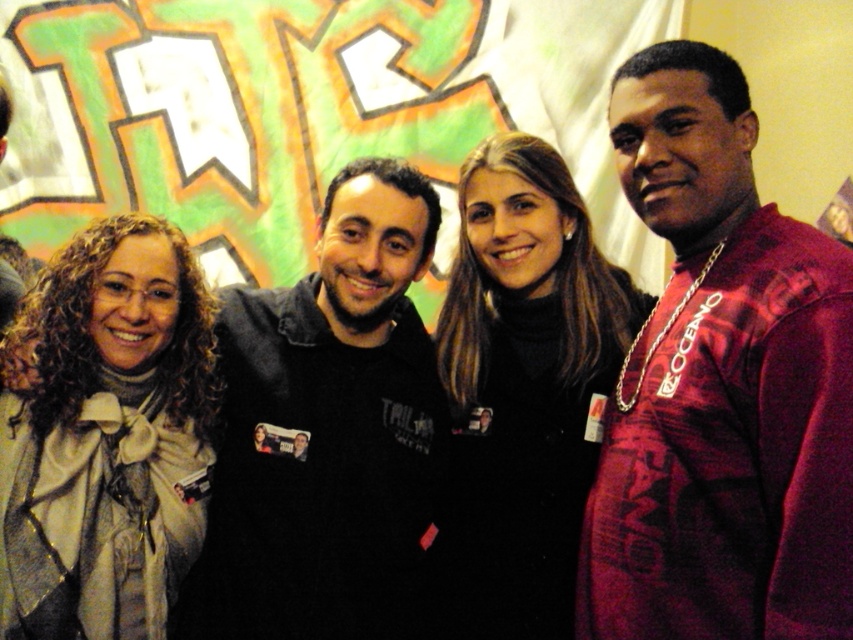
Can you confirm if shiny maroon shirt at right is positioned below black fleece at center?

No, shiny maroon shirt at right is not below black fleece at center.

Is shiny maroon shirt at right further to the viewer compared to black fleece at center?

No.

Who is more forward, (694, 413) or (332, 467)?

Point (694, 413)

The width and height of the screenshot is (853, 640). I want to click on shiny maroon shirt at right, so [721, 387].

What do you see at coordinates (721, 387) in the screenshot? I see `shiny maroon shirt at right` at bounding box center [721, 387].

The height and width of the screenshot is (640, 853). What are the coordinates of `shiny maroon shirt at right` in the screenshot? It's located at (721, 387).

You are a GUI agent. You are given a task and a screenshot of the screen. Output one action in this format:
    pyautogui.click(x=<x>, y=<y>)
    Task: Click on the light beige scarf at center
    
    Given the screenshot: What is the action you would take?
    pyautogui.click(x=105, y=435)

Does light beige scarf at center come in front of black matte jacket at center?

Yes.

Which is in front, point (73, 540) or point (519, 612)?

Point (73, 540) is more forward.

Where is `light beige scarf at center`? The image size is (853, 640). light beige scarf at center is located at coordinates (105, 435).